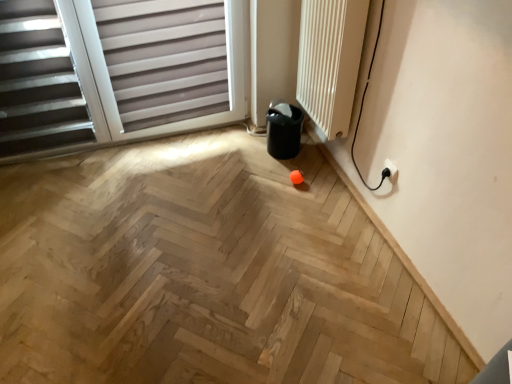
Question: Is white textured radiator at upper right positioned beyond the bounds of natural wood floor at center?

Choices:
 (A) yes
 (B) no

Answer: (A)

Question: Considering the relative positions of white textured radiator at upper right and natural wood floor at center in the image provided, is white textured radiator at upper right to the right of natural wood floor at center from the viewer's perspective?

Choices:
 (A) no
 (B) yes

Answer: (B)

Question: Does white textured radiator at upper right have a lesser height compared to natural wood floor at center?

Choices:
 (A) no
 (B) yes

Answer: (A)

Question: Is white textured radiator at upper right to the left of natural wood floor at center from the viewer's perspective?

Choices:
 (A) yes
 (B) no

Answer: (B)

Question: Is the surface of white textured radiator at upper right in direct contact with natural wood floor at center?

Choices:
 (A) yes
 (B) no

Answer: (B)

Question: Is white textured radiator at upper right aimed at natural wood floor at center?

Choices:
 (A) yes
 (B) no

Answer: (B)

Question: Can you confirm if white plastic electric outlet at lower right is positioned to the left of matte gray blinds at upper left?

Choices:
 (A) yes
 (B) no

Answer: (B)

Question: From the image's perspective, does white plastic electric outlet at lower right appear higher than matte gray blinds at upper left?

Choices:
 (A) yes
 (B) no

Answer: (B)

Question: Is the position of white plastic electric outlet at lower right more distant than that of matte gray blinds at upper left?

Choices:
 (A) no
 (B) yes

Answer: (B)

Question: Is matte gray blinds at upper left at the back of white plastic electric outlet at lower right?

Choices:
 (A) yes
 (B) no

Answer: (B)

Question: Does white plastic electric outlet at lower right have a larger size compared to matte gray blinds at upper left?

Choices:
 (A) no
 (B) yes

Answer: (A)

Question: Is white plastic electric outlet at lower right positioned beyond the bounds of matte gray blinds at upper left?

Choices:
 (A) yes
 (B) no

Answer: (A)

Question: Is white plastic electric outlet at lower right bigger than natural wood floor at center?

Choices:
 (A) no
 (B) yes

Answer: (A)